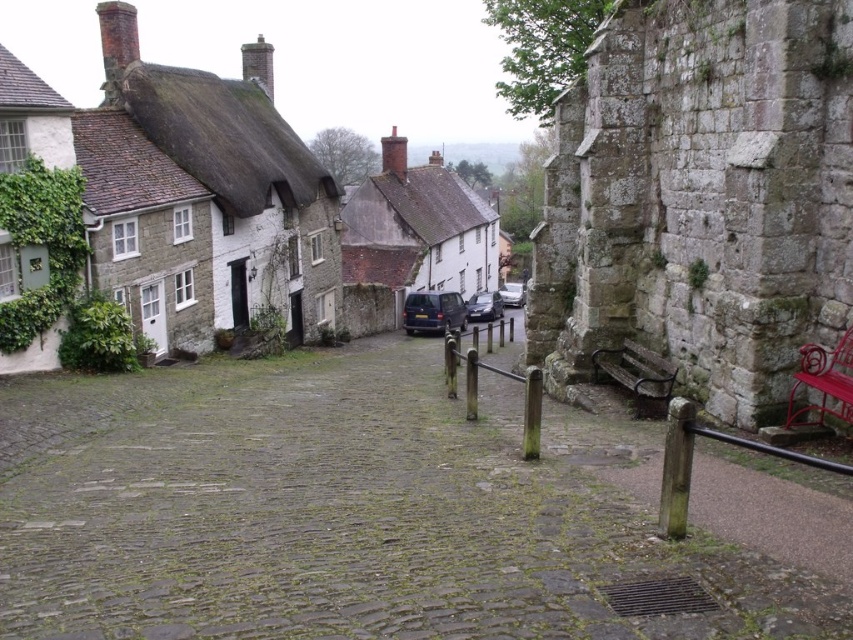
Question: In this image, where is smooth cobblestone alley at center located relative to white matte cottage at center?

Choices:
 (A) above
 (B) below

Answer: (B)

Question: Can you confirm if white matte cottage at center is positioned above red wrought iron bench at right?

Choices:
 (A) no
 (B) yes

Answer: (B)

Question: Based on their relative distances, which object is nearer to the white matte cottage at center?

Choices:
 (A) dark brown wooden bench at right
 (B) smooth cobblestone alley at center

Answer: (B)

Question: Which point appears farthest from the camera in this image?

Choices:
 (A) (457, 316)
 (B) (466, 195)

Answer: (B)

Question: Considering the relative positions of red wrought iron bench at right and shiny black car at center in the image provided, where is red wrought iron bench at right located with respect to shiny black car at center?

Choices:
 (A) right
 (B) left

Answer: (A)

Question: Among these points, which one is farthest from the camera?

Choices:
 (A) (465, 317)
 (B) (611, 248)

Answer: (A)